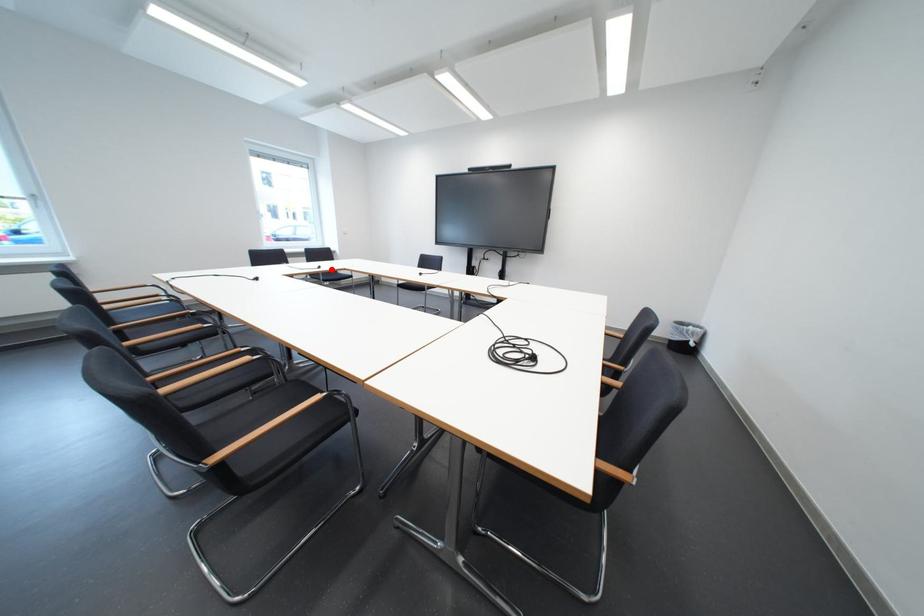
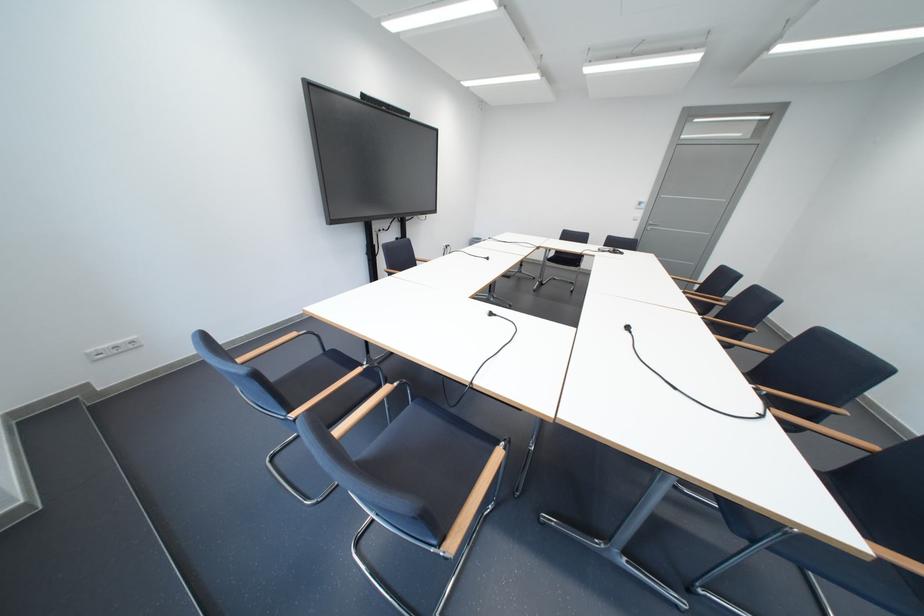
In the second image, find the point that corresponds to the highlighted location in the first image.

(503, 315)